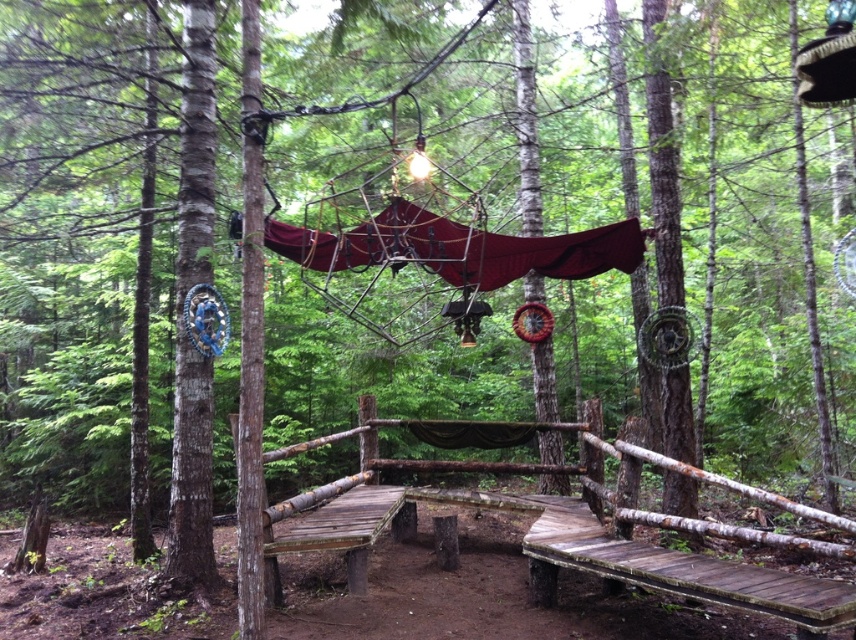
You are standing at the center of the wooden platform in the forest. You want to sit on the wooden park bench at lower right. In which direction should you walk to reach it?

You should walk towards the lower right direction to reach the wooden park bench at lower right since it is located at point (685,570).

You are planning to set up a small tent on the wooden platform. The wooden park bench at lower right and the weathered wood bench at center are both on the platform. Which bench is shorter in height?

The wooden park bench at lower right is not as tall as the weathered wood bench at center, so the wooden park bench at lower right is shorter in height.

You are standing on the wooden platform in the forest and want to sit down. Which bench, the wooden park bench at lower right or the brown wood bench at center, is closer to you?

The wooden park bench at lower right is closer to the viewer than the brown wood bench at center, so you should choose the wooden park bench at lower right.